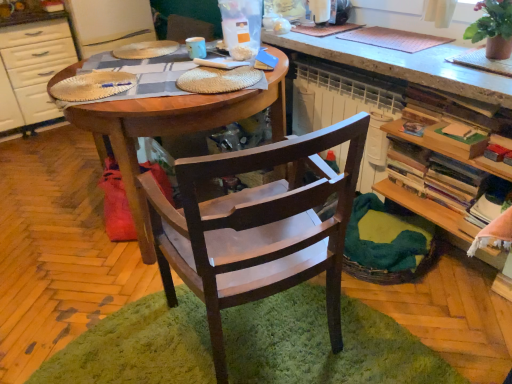
Question: Should I look upward or downward to see green shaggy rug at center?

Choices:
 (A) down
 (B) up

Answer: (A)

Question: Does wooden bookshelf at right have a greater height compared to woven brown basket at lower right?

Choices:
 (A) yes
 (B) no

Answer: (A)

Question: From a real-world perspective, is wooden bookshelf at right below woven brown basket at lower right?

Choices:
 (A) yes
 (B) no

Answer: (B)

Question: From the image's perspective, is wooden bookshelf at right located above woven brown basket at lower right?

Choices:
 (A) yes
 (B) no

Answer: (A)

Question: Is wooden bookshelf at right further to the viewer compared to woven brown basket at lower right?

Choices:
 (A) no
 (B) yes

Answer: (A)

Question: Is wooden bookshelf at right in contact with woven brown basket at lower right?

Choices:
 (A) no
 (B) yes

Answer: (A)

Question: Can you confirm if wooden bookshelf at right is thinner than woven brown basket at lower right?

Choices:
 (A) yes
 (B) no

Answer: (A)

Question: Is dark wood chair at center directly adjacent to white glossy cabinet at left?

Choices:
 (A) yes
 (B) no

Answer: (B)

Question: Is dark wood chair at center at the left side of white glossy cabinet at left?

Choices:
 (A) yes
 (B) no

Answer: (B)

Question: Would you say white glossy cabinet at left is part of dark wood chair at center's contents?

Choices:
 (A) yes
 (B) no

Answer: (B)

Question: Considering the relative sizes of dark wood chair at center and white glossy cabinet at left in the image provided, is dark wood chair at center bigger than white glossy cabinet at left?

Choices:
 (A) yes
 (B) no

Answer: (B)

Question: Does dark wood chair at center appear on the right side of white glossy cabinet at left?

Choices:
 (A) no
 (B) yes

Answer: (B)

Question: Is dark wood chair at center positioned beyond the bounds of white glossy cabinet at left?

Choices:
 (A) yes
 (B) no

Answer: (A)

Question: From the image's perspective, is wooden table at center above white glossy cabinet at left?

Choices:
 (A) no
 (B) yes

Answer: (A)